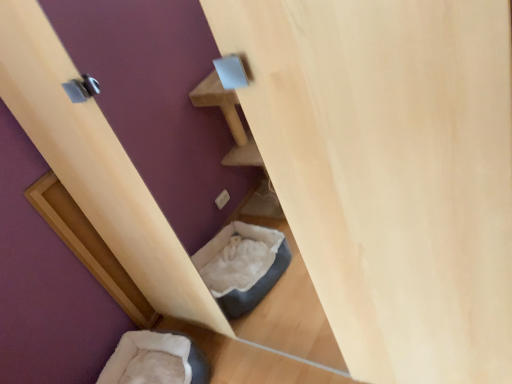
Question: Does wooden door at lower left appear on the left side of soft white fur bean bag at lower left?

Choices:
 (A) no
 (B) yes

Answer: (B)

Question: Is soft white fur bean bag at lower left completely or partially inside wooden door at lower left?

Choices:
 (A) yes
 (B) no

Answer: (B)

Question: Is wooden door at lower left shorter than soft white fur bean bag at lower left?

Choices:
 (A) yes
 (B) no

Answer: (B)

Question: Is wooden door at lower left far from soft white fur bean bag at lower left?

Choices:
 (A) yes
 (B) no

Answer: (B)

Question: Is wooden door at lower left smaller than soft white fur bean bag at lower left?

Choices:
 (A) yes
 (B) no

Answer: (A)

Question: From the image's perspective, is wooden door at lower left above soft white fur bean bag at lower left?

Choices:
 (A) no
 (B) yes

Answer: (B)

Question: Is wooden door at lower left completely or partially inside soft white fur bean bag at lower left?

Choices:
 (A) no
 (B) yes

Answer: (A)

Question: Does soft white fur bean bag at lower left lie behind wooden door at lower left?

Choices:
 (A) yes
 (B) no

Answer: (B)

Question: Is soft white fur bean bag at lower left positioned beyond the bounds of wooden door at lower left?

Choices:
 (A) no
 (B) yes

Answer: (B)

Question: Does soft white fur bean bag at lower left turn towards wooden door at lower left?

Choices:
 (A) yes
 (B) no

Answer: (B)

Question: From a real-world perspective, is soft white fur bean bag at lower left positioned over wooden door at lower left based on gravity?

Choices:
 (A) yes
 (B) no

Answer: (B)

Question: From a real-world perspective, is soft white fur bean bag at lower left below wooden door at lower left?

Choices:
 (A) no
 (B) yes

Answer: (B)

Question: Is soft white fur bean bag at lower left wider or thinner than wooden door at lower left?

Choices:
 (A) thin
 (B) wide

Answer: (B)